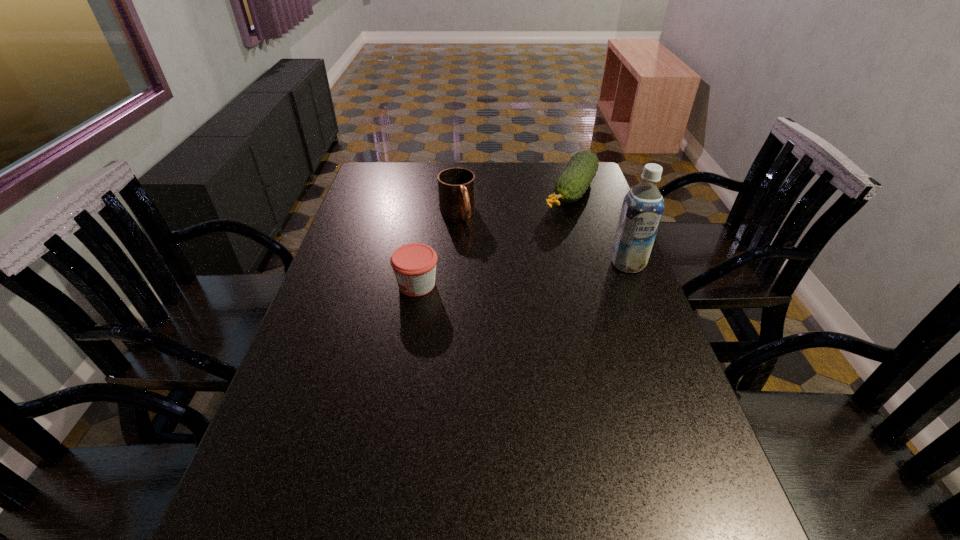
Locate an element on the screen. The height and width of the screenshot is (540, 960). vacant point located between the cucumber and the tallest object is located at coordinates (599, 228).

Identify the location of vacant region between the jam and the cucumber. (493, 238).

Where is `free spot between the jam and the soya milk`? The height and width of the screenshot is (540, 960). free spot between the jam and the soya milk is located at coordinates (522, 274).

This screenshot has height=540, width=960. What are the coordinates of `empty space between the jam and the soya milk` in the screenshot? It's located at (522, 274).

Find the location of `object that stands as the second closest to the jam`. object that stands as the second closest to the jam is located at coordinates (572, 183).

In order to click on object that is the second closest to the jam in this screenshot , I will do `click(572, 183)`.